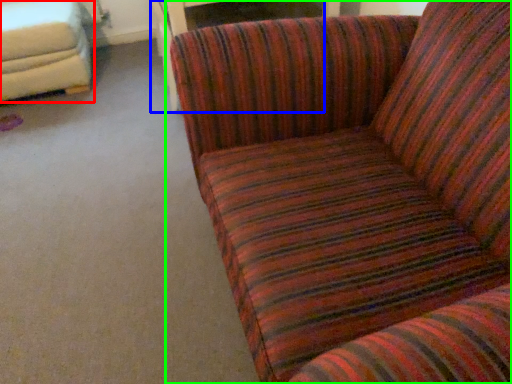
Question: Which object is the closest to the studio couch (highlighted by a red box)? Choose among these: table (highlighted by a blue box) or studio couch (highlighted by a green box).

Choices:
 (A) table
 (B) studio couch

Answer: (A)